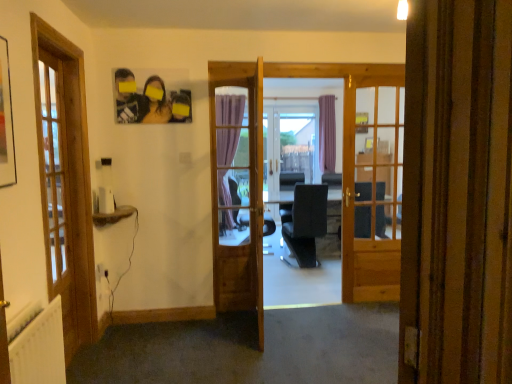
Question: From the image's perspective, is white plastic screen door at center above wooden door at center?

Choices:
 (A) yes
 (B) no

Answer: (A)

Question: Considering the relative sizes of white plastic screen door at center and wooden door at center in the image provided, is white plastic screen door at center taller than wooden door at center?

Choices:
 (A) yes
 (B) no

Answer: (A)

Question: Is the depth of white plastic screen door at center less than that of wooden door at center?

Choices:
 (A) no
 (B) yes

Answer: (A)

Question: Would you consider white plastic screen door at center to be distant from wooden door at center?

Choices:
 (A) yes
 (B) no

Answer: (A)

Question: Is white plastic screen door at center oriented towards wooden door at center?

Choices:
 (A) yes
 (B) no

Answer: (B)

Question: Is white plastic screen door at center directly adjacent to wooden door at center?

Choices:
 (A) no
 (B) yes

Answer: (A)

Question: Is white plastic screen door at center positioned behind white textured radiator at lower left?

Choices:
 (A) yes
 (B) no

Answer: (A)

Question: Is white plastic screen door at center smaller than white textured radiator at lower left?

Choices:
 (A) no
 (B) yes

Answer: (A)

Question: Could you tell me if white plastic screen door at center is turned towards white textured radiator at lower left?

Choices:
 (A) no
 (B) yes

Answer: (A)

Question: From the image's perspective, is white plastic screen door at center on white textured radiator at lower left?

Choices:
 (A) no
 (B) yes

Answer: (B)

Question: Is white plastic screen door at center surrounding white textured radiator at lower left?

Choices:
 (A) yes
 (B) no

Answer: (B)

Question: From a real-world perspective, is white plastic screen door at center positioned under white textured radiator at lower left based on gravity?

Choices:
 (A) no
 (B) yes

Answer: (A)

Question: Can you confirm if wooden door at center is smaller than white textured radiator at lower left?

Choices:
 (A) no
 (B) yes

Answer: (A)